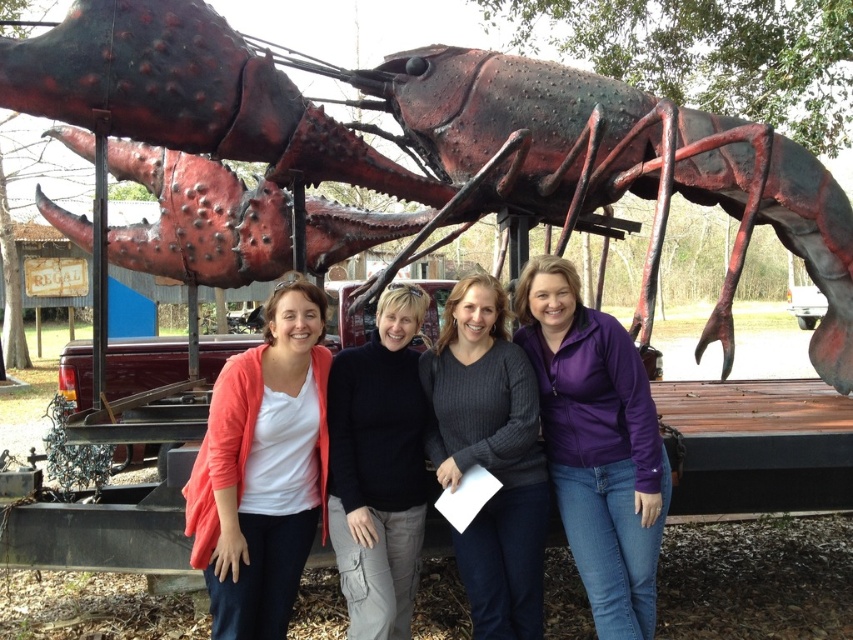
You are a photographer trying to capture both the purple fleece jacket at center and the ribbed sweater at center in your shot. Since you want to emphasize the size difference between them, which one should you position closer to the camera to achieve this effect?

To emphasize the size difference between the purple fleece jacket at center and the ribbed sweater at center, you should position the purple fleece jacket at center closer to the camera since it is larger in size compared to the ribbed sweater at center.

You are an artist trying to sketch the scene. You need to decide which object to draw first based on their positions. Which object is closer to you, the metallic red lobster at center or the ribbed sweater at center?

The metallic red lobster at center is closer to the viewer than the ribbed sweater at center, so you should draw the metallic red lobster at center first.